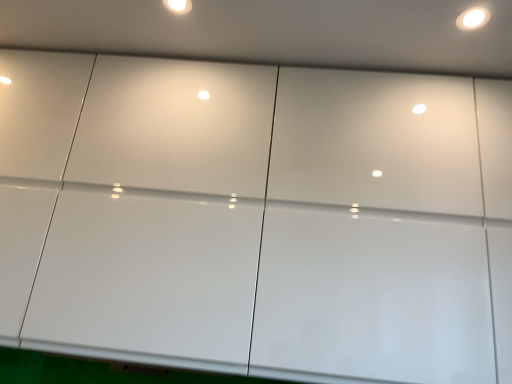
I want to click on white glossy light fixture at upper center, so click(x=178, y=6).

The height and width of the screenshot is (384, 512). What do you see at coordinates (178, 6) in the screenshot?
I see `white glossy light fixture at upper center` at bounding box center [178, 6].

Find the location of a particular element. white glossy light at upper right is located at coordinates (473, 18).

Describe the element at coordinates (473, 18) in the screenshot. Image resolution: width=512 pixels, height=384 pixels. I see `white glossy light at upper right` at that location.

What are the coordinates of `white glossy light fixture at upper center` in the screenshot? It's located at (178, 6).

Would you say white glossy light fixture at upper center is to the left or to the right of white glossy light at upper right in the picture?

white glossy light fixture at upper center is to the left of white glossy light at upper right.

Which is in front, white glossy light fixture at upper center or white glossy light at upper right?

white glossy light at upper right.

Does point (175, 11) appear closer or farther from the camera than point (479, 15)?

Point (175, 11) is farther from the camera than point (479, 15).

From the image's perspective, is white glossy light fixture at upper center on top of white glossy light at upper right?

Yes, from the image's perspective, white glossy light fixture at upper center is over white glossy light at upper right.

From a real-world perspective, is white glossy light fixture at upper center beneath white glossy light at upper right?

No, from a real-world perspective, white glossy light fixture at upper center is not beneath white glossy light at upper right.

Can you confirm if white glossy light fixture at upper center is thinner than white glossy light at upper right?

Correct, the width of white glossy light fixture at upper center is less than that of white glossy light at upper right.

Looking at this image, considering the sizes of objects white glossy light fixture at upper center and white glossy light at upper right in the image provided, who is shorter, white glossy light fixture at upper center or white glossy light at upper right?

white glossy light fixture at upper center is shorter.

Can you confirm if white glossy light fixture at upper center is bigger than white glossy light at upper right?

No, white glossy light fixture at upper center is not bigger than white glossy light at upper right.

Looking at this image, is white glossy light fixture at upper center inside the boundaries of white glossy light at upper right, or outside?

white glossy light fixture at upper center is not inside white glossy light at upper right, it's outside.

Would you consider white glossy light fixture at upper center to be distant from white glossy light at upper right?

No, white glossy light fixture at upper center is in close proximity to white glossy light at upper right.

Is white glossy light fixture at upper center positioned with its back to white glossy light at upper right?

white glossy light fixture at upper center does not have its back to white glossy light at upper right.

Locate an element on the screen. This screenshot has height=384, width=512. dot above the white glossy light at upper right (from a real-world perspective) is located at coordinates (178, 6).

Which is more to the right, white glossy light at upper right or white glossy light fixture at upper center?

From the viewer's perspective, white glossy light at upper right appears more on the right side.

Looking at this image, considering the positions of objects white glossy light at upper right and white glossy light fixture at upper center in the image provided, who is behind, white glossy light at upper right or white glossy light fixture at upper center?

white glossy light fixture at upper center is more distant.

Is point (470, 28) positioned before point (182, 4)?

Yes, it is.

From the image's perspective, does white glossy light at upper right appear higher than white glossy light fixture at upper center?

No, from the image's perspective, white glossy light at upper right is not over white glossy light fixture at upper center.

From a real-world perspective, is white glossy light at upper right below white glossy light fixture at upper center?

Yes, from a real-world perspective, white glossy light at upper right is below white glossy light fixture at upper center.

Considering the sizes of objects white glossy light at upper right and white glossy light fixture at upper center in the image provided, who is thinner, white glossy light at upper right or white glossy light fixture at upper center?

white glossy light fixture at upper center is thinner.

Between white glossy light at upper right and white glossy light fixture at upper center, which one has less height?

white glossy light fixture at upper center.

Considering the relative sizes of white glossy light at upper right and white glossy light fixture at upper center in the image provided, is white glossy light at upper right bigger than white glossy light fixture at upper center?

Yes.

Is white glossy light at upper right inside or outside of white glossy light fixture at upper center?

white glossy light at upper right exists outside the volume of white glossy light fixture at upper center.

Is white glossy light at upper right positioned far away from white glossy light fixture at upper center?

That's not correct — white glossy light at upper right is a little close to white glossy light fixture at upper center.

Is white glossy light at upper right positioned with its back to white glossy light fixture at upper center?

No, white glossy light at upper right is not facing the opposite direction of white glossy light fixture at upper center.

Could you measure the distance between white glossy light at upper right and white glossy light fixture at upper center?

A distance of 29.54 inches exists between white glossy light at upper right and white glossy light fixture at upper center.

The width and height of the screenshot is (512, 384). What are the coordinates of `light on the right side of white glossy light fixture at upper center` in the screenshot? It's located at (473, 18).

Locate an element on the screen. This screenshot has width=512, height=384. light that is on the right side of white glossy light fixture at upper center is located at coordinates (473, 18).

You are a GUI agent. You are given a task and a screenshot of the screen. Output one action in this format:
    pyautogui.click(x=<x>, y=<y>)
    Task: Click on the dot lying behind the white glossy light at upper right
    The width and height of the screenshot is (512, 384).
    Given the screenshot: What is the action you would take?
    pyautogui.click(x=178, y=6)